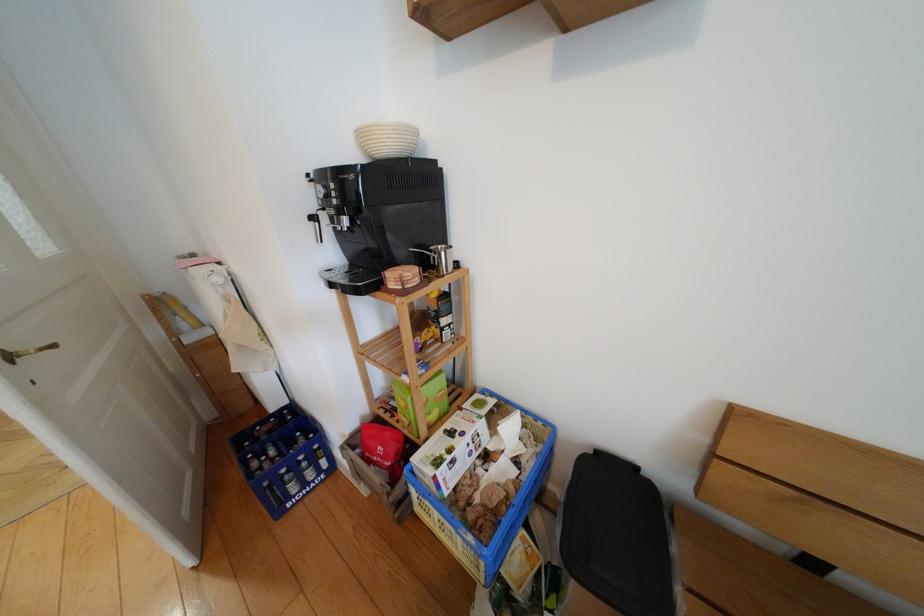
What do you see at coordinates (616, 536) in the screenshot? I see `the black trash can lid` at bounding box center [616, 536].